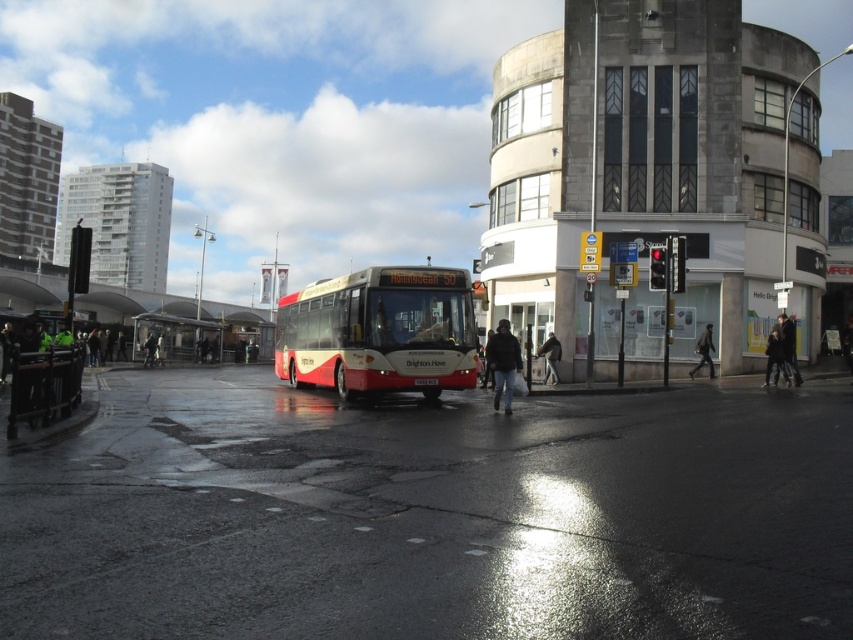
Question: Does dark blue jeans at center have a larger size compared to dark gray jacket at lower right?

Choices:
 (A) no
 (B) yes

Answer: (B)

Question: Does dark blue jeans at center appear on the left side of dark gray jacket at center?

Choices:
 (A) yes
 (B) no

Answer: (A)

Question: Which point appears farthest from the camera in this image?

Choices:
 (A) (705, 340)
 (B) (502, 330)
 (C) (194, 324)
 (D) (773, 324)

Answer: (C)

Question: Which object is the closest to the dark blue jeans at center?

Choices:
 (A) dark brown leather jacket at lower right
 (B) red matte bus at center
 (C) dark gray fabric coat at center

Answer: (B)

Question: Can you confirm if dark blue jeans at center is positioned above dark brown leather jacket at lower right?

Choices:
 (A) yes
 (B) no

Answer: (B)

Question: Which point is farther from the camera taking this photo?

Choices:
 (A) (281, 330)
 (B) (704, 356)

Answer: (B)